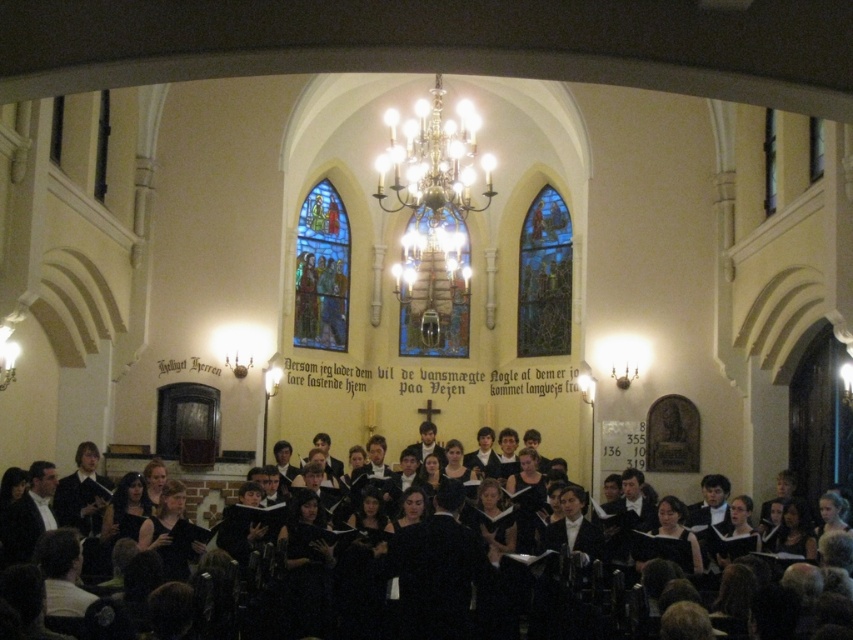
You are an interior designer planning to install a new lighting fixture in the church. You want to place it above the stained glass window at upper center and the stained glass window at center. Given their sizes, which window would allow for a larger fixture without blocking the view of the window itself?

The stained glass window at upper center is larger in size than the stained glass window at center, so it would allow for a larger lighting fixture without blocking the view of the window itself.